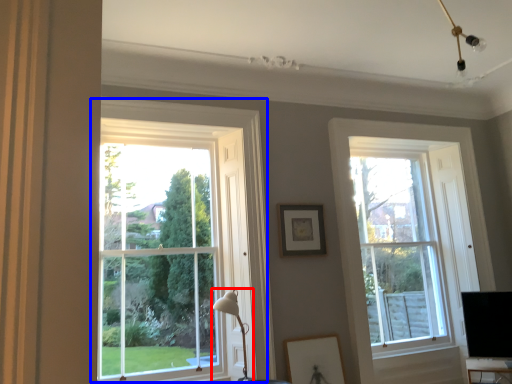
Question: Which point is closer to the camera, table lamp (highlighted by a red box) or window (highlighted by a blue box)?

Choices:
 (A) table lamp
 (B) window

Answer: (A)